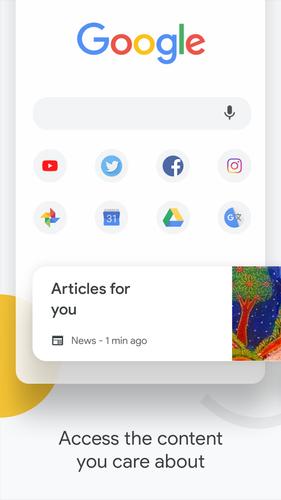
I want to click on picture, so click(265, 353).